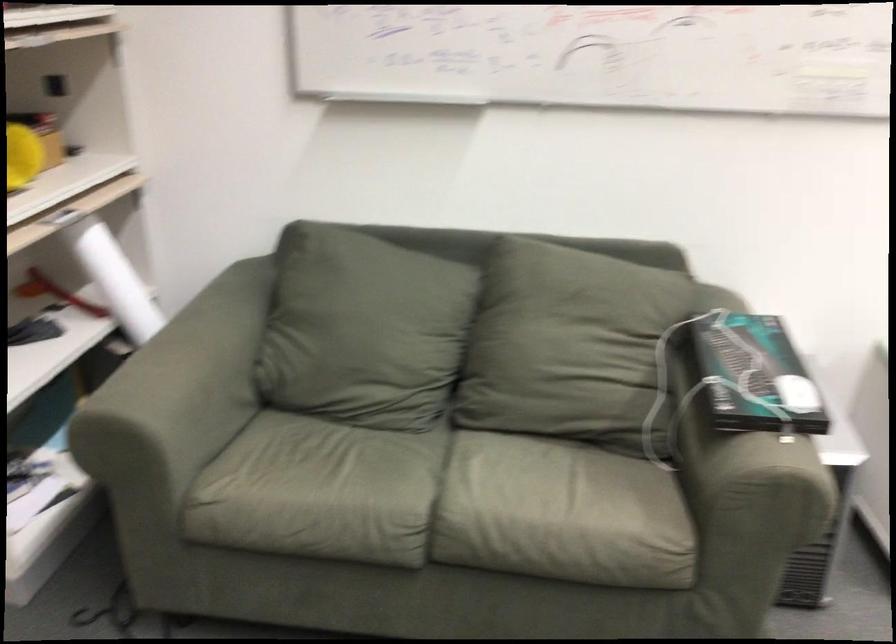
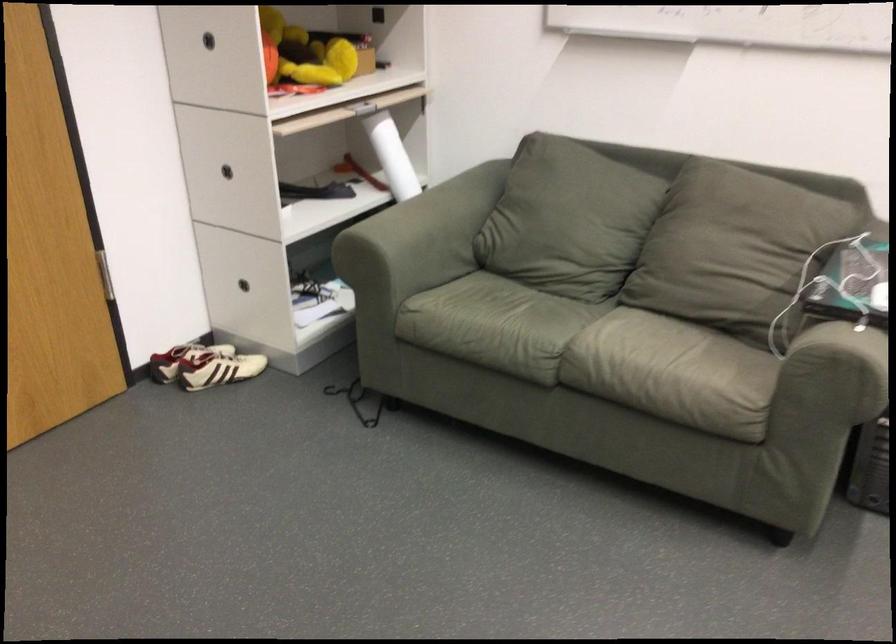
Find the pixel in the second image that matches point (194, 400) in the first image.

(416, 242)